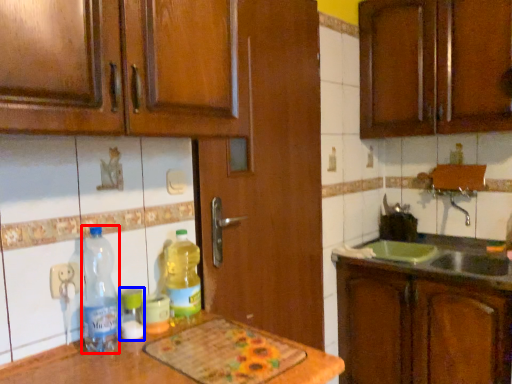
Question: Among these objects, which one is farthest to the camera, bottle (highlighted by a red box) or bottle (highlighted by a blue box)?

Choices:
 (A) bottle
 (B) bottle

Answer: (B)